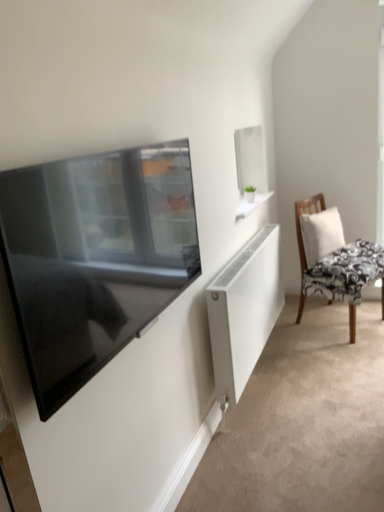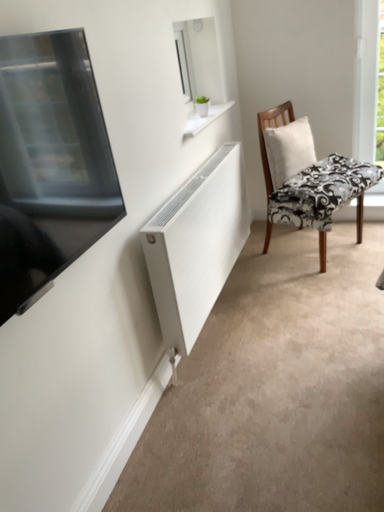
Question: Which way did the camera rotate in the video?

Choices:
 (A) rotated downward
 (B) rotated upward

Answer: (A)